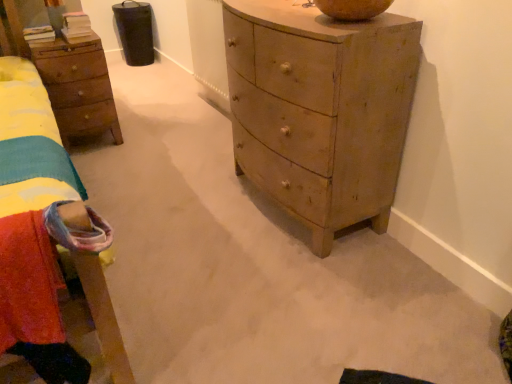
Question: Can you confirm if light brown wooden chest of drawers at center is taller than velvety red blanket at lower left?

Choices:
 (A) yes
 (B) no

Answer: (A)

Question: From the image's perspective, is light brown wooden chest of drawers at center located beneath velvety red blanket at lower left?

Choices:
 (A) yes
 (B) no

Answer: (B)

Question: From a real-world perspective, is light brown wooden chest of drawers at center beneath velvety red blanket at lower left?

Choices:
 (A) yes
 (B) no

Answer: (A)

Question: Does light brown wooden chest of drawers at center turn towards velvety red blanket at lower left?

Choices:
 (A) yes
 (B) no

Answer: (A)

Question: Would you say light brown wooden chest of drawers at center is a long distance from velvety red blanket at lower left?

Choices:
 (A) no
 (B) yes

Answer: (A)

Question: Is light brown wooden chest of drawers at center bigger or smaller than velvety red blanket at lower left?

Choices:
 (A) small
 (B) big

Answer: (B)

Question: Is point (262, 8) positioned closer to the camera than point (25, 218)?

Choices:
 (A) closer
 (B) farther

Answer: (B)

Question: Looking at their shapes, would you say light brown wooden chest of drawers at center is wider or thinner than velvety red blanket at lower left?

Choices:
 (A) thin
 (B) wide

Answer: (B)

Question: Is light brown wooden chest of drawers at center taller or shorter than velvety red blanket at lower left?

Choices:
 (A) tall
 (B) short

Answer: (A)

Question: From a real-world perspective, relative to wooden nightstand at left, is velvety red blanket at lower left vertically above or below?

Choices:
 (A) below
 (B) above

Answer: (B)

Question: Relative to wooden nightstand at left, is velvety red blanket at lower left in front or behind?

Choices:
 (A) behind
 (B) front

Answer: (B)

Question: Considering the positions of velvety red blanket at lower left and wooden nightstand at left in the image, is velvety red blanket at lower left wider or thinner than wooden nightstand at left?

Choices:
 (A) thin
 (B) wide

Answer: (A)

Question: Is velvety red blanket at lower left spatially inside wooden nightstand at left, or outside of it?

Choices:
 (A) inside
 (B) outside

Answer: (B)

Question: Is wooden nightstand at left to the left or to the right of light brown wooden chest of drawers at center in the image?

Choices:
 (A) right
 (B) left

Answer: (B)

Question: Is wooden nightstand at left inside the boundaries of light brown wooden chest of drawers at center, or outside?

Choices:
 (A) inside
 (B) outside

Answer: (B)